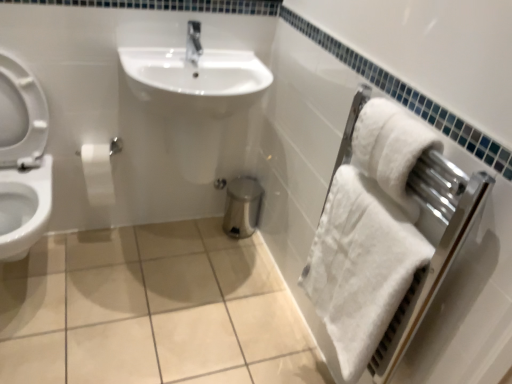
Question: Could you tell me if white soft towel at right is facing white fluffy bath towel at right, positioned as the second bath towel in top-to-bottom order?

Choices:
 (A) no
 (B) yes

Answer: (B)

Question: Is white soft towel at right placed right next to white fluffy bath towel at right, the first bath towel in the bottom-to-top sequence?

Choices:
 (A) yes
 (B) no

Answer: (B)

Question: Is white fluffy bath towel at right, the first bath towel in the bottom-to-top sequence, at the back of white soft towel at right?

Choices:
 (A) no
 (B) yes

Answer: (B)

Question: From a real-world perspective, is white soft towel at right located beneath white fluffy bath towel at right, positioned as the second bath towel in top-to-bottom order?

Choices:
 (A) yes
 (B) no

Answer: (B)

Question: Considering the relative sizes of white soft towel at right and white fluffy bath towel at right, the first bath towel in the bottom-to-top sequence, in the image provided, is white soft towel at right wider than white fluffy bath towel at right, the first bath towel in the bottom-to-top sequence,?

Choices:
 (A) no
 (B) yes

Answer: (A)

Question: Is white soft towel at right completely or partially outside of white fluffy bath towel at right, positioned as the second bath towel in top-to-bottom order?

Choices:
 (A) yes
 (B) no

Answer: (B)

Question: Considering the relative sizes of white matte toilet paper at left and white glossy toilet at left in the image provided, is white matte toilet paper at left shorter than white glossy toilet at left?

Choices:
 (A) no
 (B) yes

Answer: (B)

Question: From a real-world perspective, does white matte toilet paper at left stand above white glossy toilet at left?

Choices:
 (A) no
 (B) yes

Answer: (A)

Question: Can you confirm if white matte toilet paper at left is positioned to the right of white glossy toilet at left?

Choices:
 (A) yes
 (B) no

Answer: (A)

Question: From the image's perspective, is white matte toilet paper at left above white glossy toilet at left?

Choices:
 (A) yes
 (B) no

Answer: (A)

Question: Does white matte toilet paper at left have a lesser width compared to white glossy toilet at left?

Choices:
 (A) no
 (B) yes

Answer: (B)

Question: Is white matte toilet paper at left in contact with white glossy toilet at left?

Choices:
 (A) yes
 (B) no

Answer: (B)

Question: Considering the relative positions of white glossy toilet at left and white matte toilet paper at left in the image provided, is white glossy toilet at left behind white matte toilet paper at left?

Choices:
 (A) no
 (B) yes

Answer: (A)